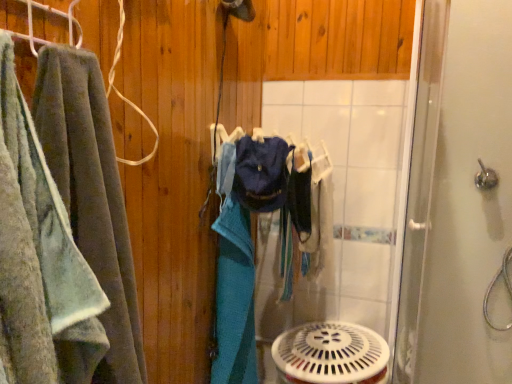
Identify the location of clear glass shower door at right. coord(457,197).

Find the location of `silver metallic shower handle at upper right`. silver metallic shower handle at upper right is located at coordinates (485, 177).

In order to face white plastic mechanical fan at lower center, should I rotate leftwards or rightwards?

It's best to rotate right around 9.944 degrees.

The height and width of the screenshot is (384, 512). I want to click on clear glass shower door at right, so click(457, 197).

Considering the sizes of white plastic mechanical fan at lower center and soft green towel at left in the image, is white plastic mechanical fan at lower center taller or shorter than soft green towel at left?

white plastic mechanical fan at lower center is shorter than soft green towel at left.

From the image's perspective, which one is positioned higher, white plastic mechanical fan at lower center or soft green towel at left?

soft green towel at left appears higher in the image.

Could you tell me if white plastic mechanical fan at lower center is turned towards silver metallic shower handle at upper right?

No.

Between white plastic mechanical fan at lower center and silver metallic shower handle at upper right, which one has larger size?

white plastic mechanical fan at lower center.

Which object is positioned more to the left, white plastic mechanical fan at lower center or silver metallic shower handle at upper right?

From the viewer's perspective, white plastic mechanical fan at lower center appears more on the left side.

This screenshot has width=512, height=384. Find the location of `mechanical fan on the left of silver metallic shower handle at upper right`. mechanical fan on the left of silver metallic shower handle at upper right is located at coordinates (330, 354).

Could you tell me if clear glass shower door at right is facing white plastic mechanical fan at lower center?

Yes, clear glass shower door at right is facing white plastic mechanical fan at lower center.

Consider the image. From the image's perspective, which object appears higher, clear glass shower door at right or white plastic mechanical fan at lower center?

clear glass shower door at right, from the image's perspective.

Considering the points (482, 89) and (304, 383), which point is in front, point (482, 89) or point (304, 383)?

The point (304, 383) is closer to the camera.

Is clear glass shower door at right positioned far away from white plastic mechanical fan at lower center?

No.

Based on their positions, is silver metallic shower handle at upper right located to the left or right of clear glass shower door at right?

Based on their positions, silver metallic shower handle at upper right is located to the right of clear glass shower door at right.

Does silver metallic shower handle at upper right turn towards clear glass shower door at right?

Yes, silver metallic shower handle at upper right is oriented towards clear glass shower door at right.

From a real-world perspective, which object stands above the other?

From a 3D spatial view, silver metallic shower handle at upper right is above.

Is silver metallic shower handle at upper right not close to clear glass shower door at right?

That's not correct — silver metallic shower handle at upper right is a little close to clear glass shower door at right.

Based on their sizes in the image, would you say clear glass shower door at right is bigger or smaller than silver metallic shower handle at upper right?

clear glass shower door at right is bigger than silver metallic shower handle at upper right.

Which is nearer, (x=503, y=40) or (x=486, y=184)?

Clearly, point (x=503, y=40) is closer to the camera than point (x=486, y=184).

From the picture: Which of these two, clear glass shower door at right or silver metallic shower handle at upper right, stands taller?

clear glass shower door at right is taller.

Is clear glass shower door at right turned away from silver metallic shower handle at upper right?

Yes, silver metallic shower handle at upper right is at the back of clear glass shower door at right.

Which object is positioned more to the left, silver metallic shower handle at upper right or soft green towel at left?

Positioned to the left is soft green towel at left.

Is silver metallic shower handle at upper right not inside soft green towel at left?

Indeed, silver metallic shower handle at upper right is completely outside soft green towel at left.

From the picture: Which of these two, silver metallic shower handle at upper right or soft green towel at left, stands taller?

Standing taller between the two is soft green towel at left.

Considering the relative sizes of silver metallic shower handle at upper right and soft green towel at left in the image provided, is silver metallic shower handle at upper right smaller than soft green towel at left?

Correct, silver metallic shower handle at upper right occupies less space than soft green towel at left.

From the image's perspective, is clear glass shower door at right located beneath soft green towel at left?

Correct, clear glass shower door at right appears lower than soft green towel at left in the image.

Which of these two, clear glass shower door at right or soft green towel at left, is smaller?

soft green towel at left.

Does clear glass shower door at right touch soft green towel at left?

No, clear glass shower door at right is not in contact with soft green towel at left.

Which is in front, point (497, 31) or point (42, 192)?

The point (42, 192) is more forward.

At what (x,y) coordinates should I click in order to perform the action: click on mechanical fan below the soft green towel at left (from a real-world perspective). Please return your answer as a coordinate pair (x, y). This screenshot has width=512, height=384. Looking at the image, I should click on (330, 354).

Where is `shower located above the white plastic mechanical fan at lower center (from a real-world perspective)`? The height and width of the screenshot is (384, 512). shower located above the white plastic mechanical fan at lower center (from a real-world perspective) is located at coordinates (485, 177).

Looking at the image, which one is located closer to silver metallic shower handle at upper right, soft green towel at left or white plastic mechanical fan at lower center?

white plastic mechanical fan at lower center.

From the image, which object appears to be farther from silver metallic shower handle at upper right, soft green towel at left or clear glass shower door at right?

soft green towel at left.

When comparing their distances from soft green towel at left, does silver metallic shower handle at upper right or white plastic mechanical fan at lower center seem closer?

white plastic mechanical fan at lower center is closer to soft green towel at left.

Estimate the real-world distances between objects in this image. Which object is closer to clear glass shower door at right, soft green towel at left or white plastic mechanical fan at lower center?

Based on the image, white plastic mechanical fan at lower center appears to be nearer to clear glass shower door at right.

Based on their spatial positions, is clear glass shower door at right or soft green towel at left closer to white plastic mechanical fan at lower center?

clear glass shower door at right.

From the image, which object appears to be farther from soft green towel at left, clear glass shower door at right or silver metallic shower handle at upper right?

silver metallic shower handle at upper right lies further to soft green towel at left than the other object.

When comparing their distances from silver metallic shower handle at upper right, does clear glass shower door at right or white plastic mechanical fan at lower center seem further?

Based on the image, white plastic mechanical fan at lower center appears to be further to silver metallic shower handle at upper right.

Estimate the real-world distances between objects in this image. Which object is closer to silver metallic shower handle at upper right, white plastic mechanical fan at lower center or soft green towel at left?

Based on the image, white plastic mechanical fan at lower center appears to be nearer to silver metallic shower handle at upper right.

You are a GUI agent. You are given a task and a screenshot of the screen. Output one action in this format:
    pyautogui.click(x=<x>, y=<y>)
    Task: Click on the mechanical fan located between soft green towel at left and silver metallic shower handle at upper right in the depth direction
    The image size is (512, 384).
    Given the screenshot: What is the action you would take?
    [x=330, y=354]

You are a GUI agent. You are given a task and a screenshot of the screen. Output one action in this format:
    pyautogui.click(x=<x>, y=<y>)
    Task: Click on the screen door between soft green towel at left and white plastic mechanical fan at lower center along the z-axis
    Image resolution: width=512 pixels, height=384 pixels.
    Given the screenshot: What is the action you would take?
    pyautogui.click(x=457, y=197)

Where is `mechanical fan located between clear glass shower door at right and silver metallic shower handle at upper right in the depth direction`? This screenshot has height=384, width=512. mechanical fan located between clear glass shower door at right and silver metallic shower handle at upper right in the depth direction is located at coordinates (330, 354).

Find the location of `screen door between soft green towel at left and silver metallic shower handle at upper right`. screen door between soft green towel at left and silver metallic shower handle at upper right is located at coordinates [457, 197].